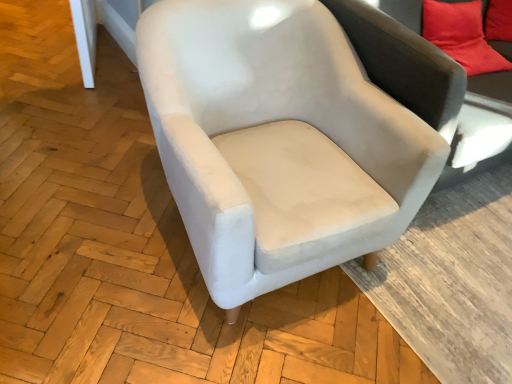
Question: Is velvet beige swivel chair at center taller or shorter than velvet red pillow at upper right?

Choices:
 (A) tall
 (B) short

Answer: (A)

Question: From the image's perspective, is velvet beige swivel chair at center above or below velvet red pillow at upper right?

Choices:
 (A) below
 (B) above

Answer: (A)

Question: Which object is the farthest from the velvet-like gray couch at upper right?

Choices:
 (A) velvet red pillow at upper right
 (B) suede-like beige armchair at center
 (C) velvet beige swivel chair at center

Answer: (B)

Question: Which is farther from the suede-like beige armchair at center?

Choices:
 (A) velvet-like gray couch at upper right
 (B) velvet beige swivel chair at center
 (C) velvet red pillow at upper right

Answer: (A)